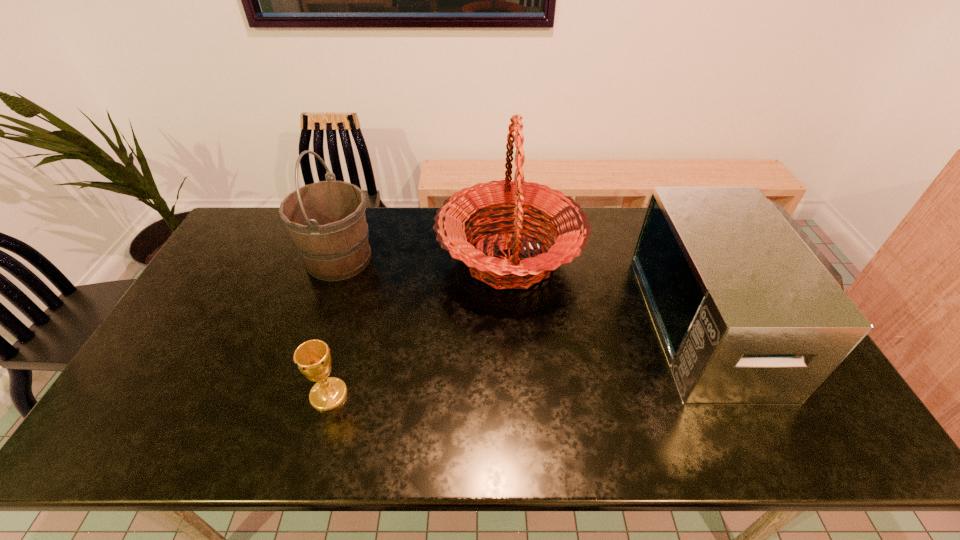
The width and height of the screenshot is (960, 540). In order to click on object that ranks as the third closest to the chalice in this screenshot , I will do `click(748, 310)`.

You are a GUI agent. You are given a task and a screenshot of the screen. Output one action in this format:
    pyautogui.click(x=<x>, y=<y>)
    Task: Click on the vacant position in the image that satisfies the following two spatial constraints: 1. on the front side of the bucket; 2. on the right side of the chalice
    This screenshot has width=960, height=540.
    Given the screenshot: What is the action you would take?
    pyautogui.click(x=292, y=395)

Identify the location of vacant space that satisfies the following two spatial constraints: 1. on the front side of the second tallest object; 2. on the right side of the second object from right to left. This screenshot has height=540, width=960. coord(339,260).